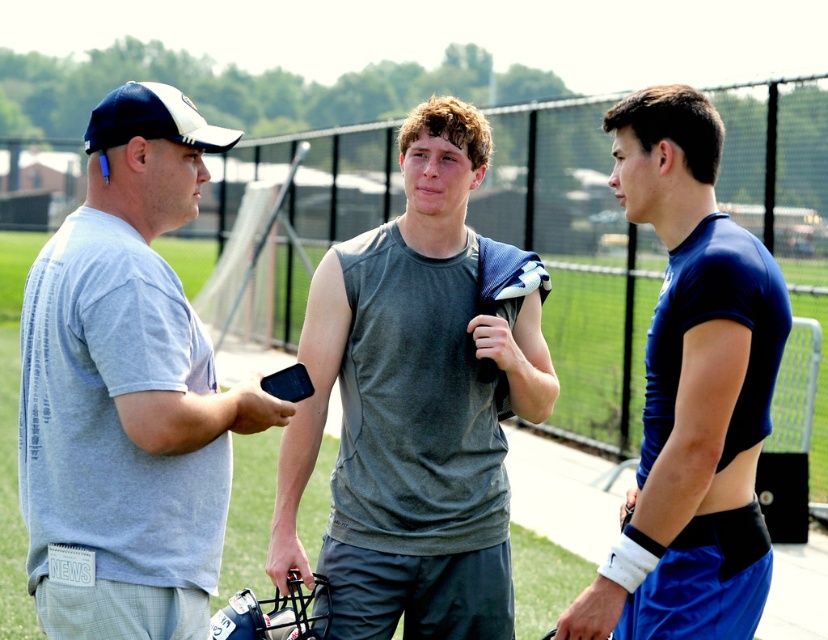
Is gray matte tank top at center bigger than blue matte shirt at center?

Indeed, gray matte tank top at center has a larger size compared to blue matte shirt at center.

Who is lower down, gray matte tank top at center or blue matte shirt at center?

gray matte tank top at center is lower down.

Which is in front, point (474, 237) or point (697, 323)?

Point (697, 323)

Locate an element on the screen. gray matte tank top at center is located at coordinates (414, 406).

Can you confirm if gray cotton t-shirt at left is positioned to the right of blue matte shirt at center?

In fact, gray cotton t-shirt at left is to the left of blue matte shirt at center.

What are the coordinates of `gray cotton t-shirt at left` in the screenshot? It's located at (128, 392).

The image size is (828, 640). What do you see at coordinates (128, 392) in the screenshot?
I see `gray cotton t-shirt at left` at bounding box center [128, 392].

Identify the location of gray cotton t-shirt at left. (128, 392).

Between point (696, 253) and point (123, 88), which one is positioned behind?

The point (123, 88) is behind.

Does blue matte shirt at center have a lesser height compared to white matte baseball cap at upper left?

In fact, blue matte shirt at center may be taller than white matte baseball cap at upper left.

What are the coordinates of `blue matte shirt at center` in the screenshot? It's located at (691, 394).

The height and width of the screenshot is (640, 828). In order to click on blue matte shirt at center in this screenshot , I will do `click(691, 394)`.